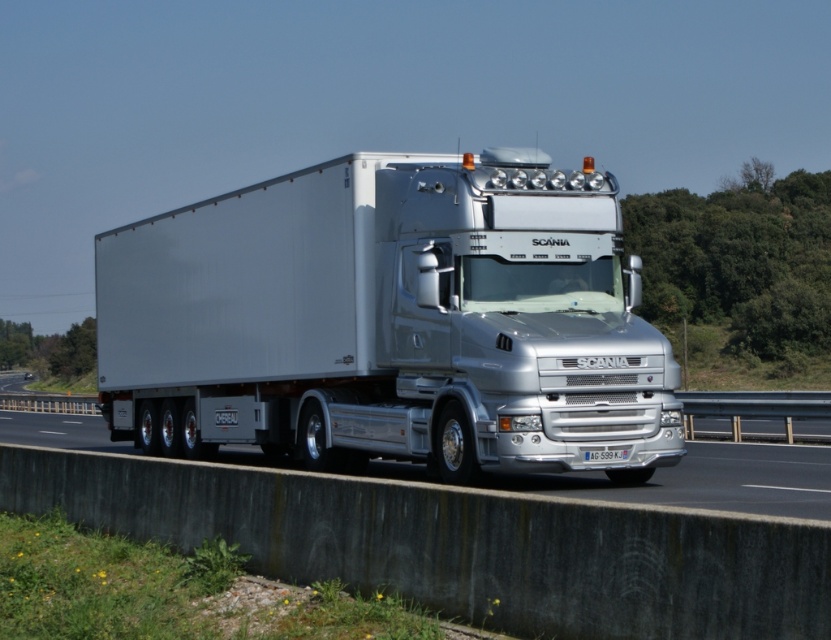
Question: Among these objects, which one is farthest from the camera?

Choices:
 (A) silver metallic highway at center
 (B) silver metallic truck at center

Answer: (B)

Question: Which object appears closest to the camera in this image?

Choices:
 (A) silver metallic truck at center
 (B) silver metallic highway at center

Answer: (B)

Question: In this image, where is silver metallic truck at center located relative to silver metallic highway at center?

Choices:
 (A) below
 (B) above

Answer: (B)

Question: Is silver metallic truck at center positioned in front of silver metallic highway at center?

Choices:
 (A) yes
 (B) no

Answer: (B)

Question: Does silver metallic truck at center appear on the left side of silver metallic highway at center?

Choices:
 (A) yes
 (B) no

Answer: (B)

Question: Which object is farther from the camera taking this photo?

Choices:
 (A) silver metallic truck at center
 (B) silver metallic highway at center

Answer: (A)